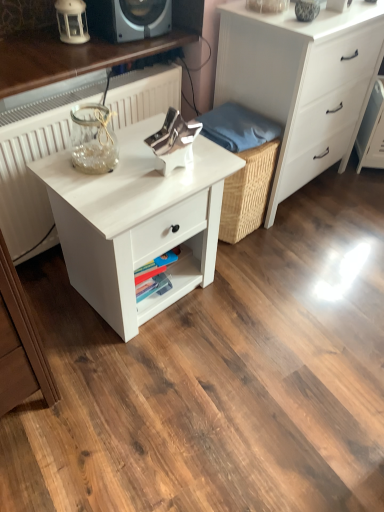
Locate an element on the screen. The image size is (384, 512). free space to the right of white matte nightstand at center is located at coordinates (251, 298).